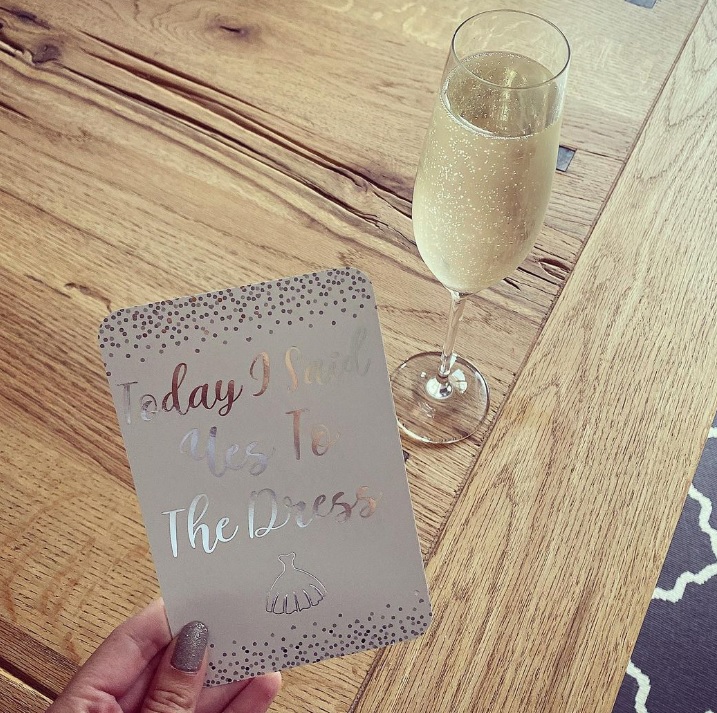
In order to click on wooden surface in this screenshot , I will do `click(525, 615)`.